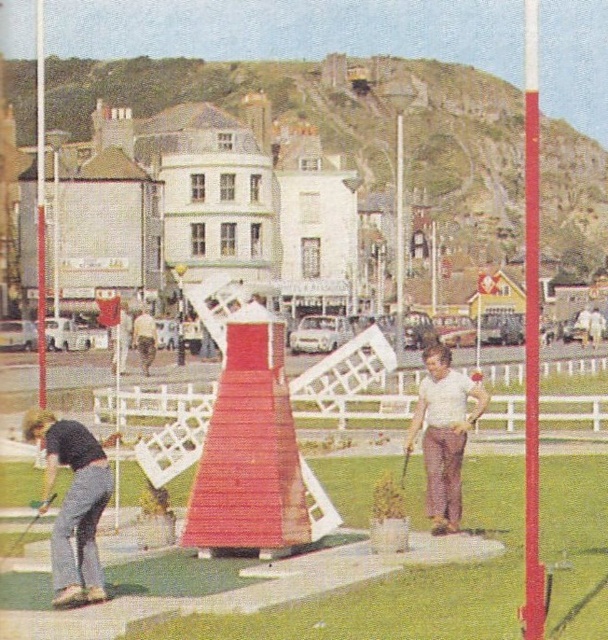
Question: Does wooden windmill at center come behind dark gray pants at lower left?

Choices:
 (A) no
 (B) yes

Answer: (A)

Question: Which object appears closest to the camera in this image?

Choices:
 (A) light brown leather jacket at center
 (B) wooden golf club at lower left
 (C) white matte golf club at center
 (D) smooth red pole at right

Answer: (D)

Question: Does white matte golf club at center have a lesser width compared to light brown leather jacket at center?

Choices:
 (A) yes
 (B) no

Answer: (A)

Question: Which object appears farthest from the camera in this image?

Choices:
 (A) wooden windmill at center
 (B) smooth red pole at right
 (C) light brown leather jacket at center

Answer: (C)

Question: Among these points, which one is farthest from the camera?

Choices:
 (A) (7, 554)
 (B) (143, 321)
 (C) (61, 428)
 (D) (513, 588)

Answer: (B)

Question: In this image, where is wooden windmill at center located relative to wooden golf club at lower left?

Choices:
 (A) right
 (B) left

Answer: (A)